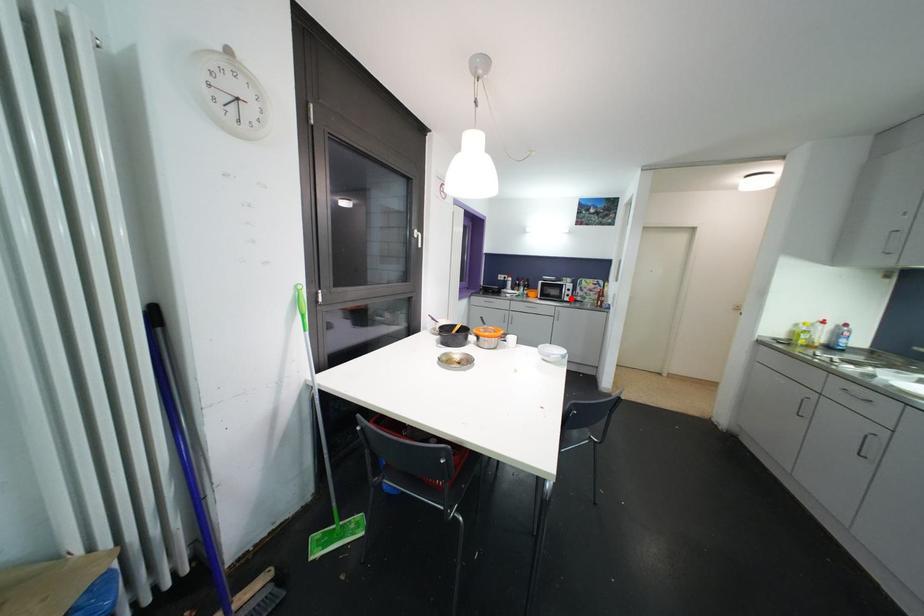
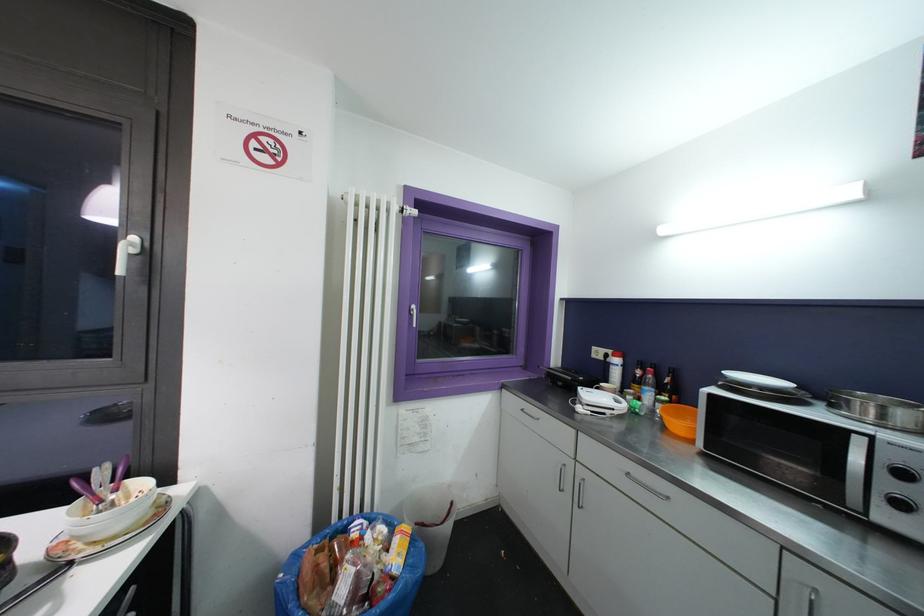
Locate, in the second image, the point that corresponds to the highlighted location in the first image.

(904, 508)